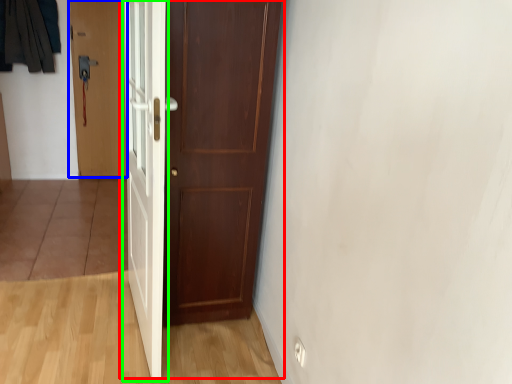
Question: Based on their relative distances, which object is nearer to door (highlighted by a red box)? Choose from door (highlighted by a blue box) and door (highlighted by a green box).

Choices:
 (A) door
 (B) door

Answer: (B)